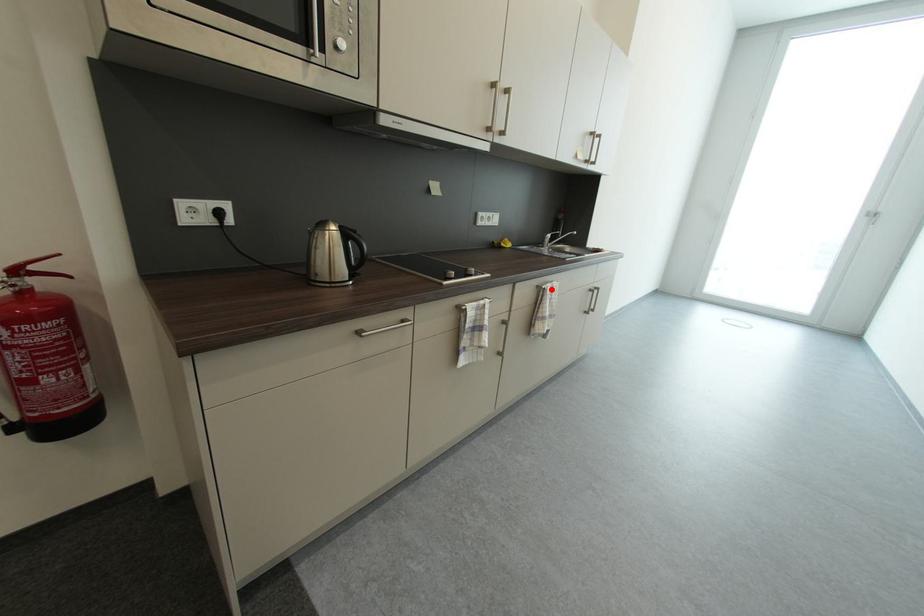
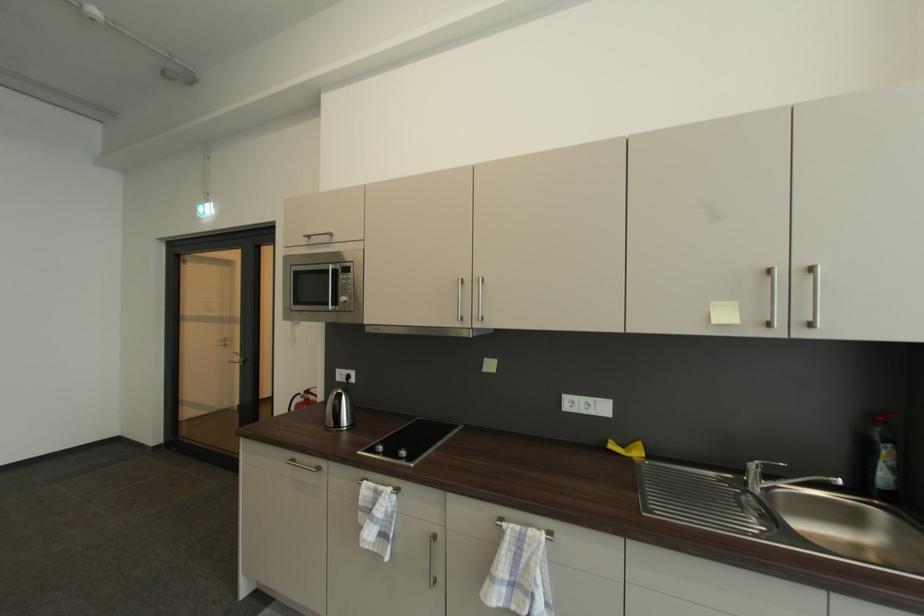
In the second image, find the point that corresponds to the highlighted location in the first image.

(507, 529)